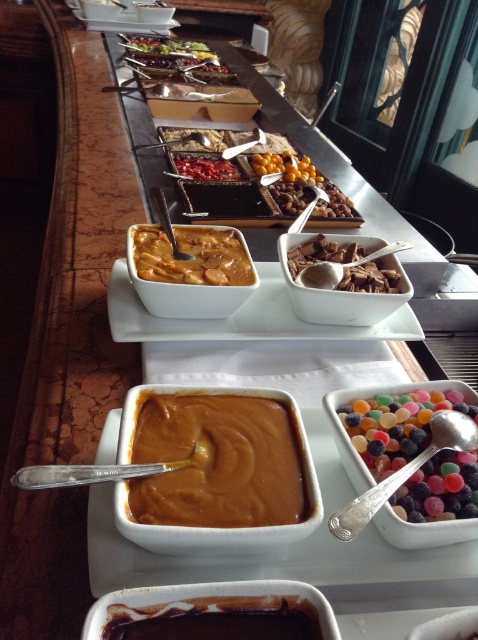
Looking at this image, is savory brown sauce at center above semi-sweet chocolate bar at center?

No.

Is point (141, 246) less distant than point (186, 164)?

That is True.

At what (x,y) coordinates should I click in order to perform the action: click on savory brown sauce at center. Please return your answer as a coordinate pair (x, y). The height and width of the screenshot is (640, 478). Looking at the image, I should click on (191, 257).

From the picture: Can you confirm if smooth caramel pudding at center is positioned below chocolate-dipped chocolate at center?

Correct, smooth caramel pudding at center is located below chocolate-dipped chocolate at center.

This screenshot has height=640, width=478. I want to click on smooth caramel pudding at center, so click(217, 461).

Can you confirm if dark glossy pudding at lower center is smaller than savory brown sauce at center?

Indeed, dark glossy pudding at lower center has a smaller size compared to savory brown sauce at center.

Which of these two, dark glossy pudding at lower center or savory brown sauce at center, stands shorter?

dark glossy pudding at lower center

Find the location of a particular element. dark glossy pudding at lower center is located at coordinates (216, 618).